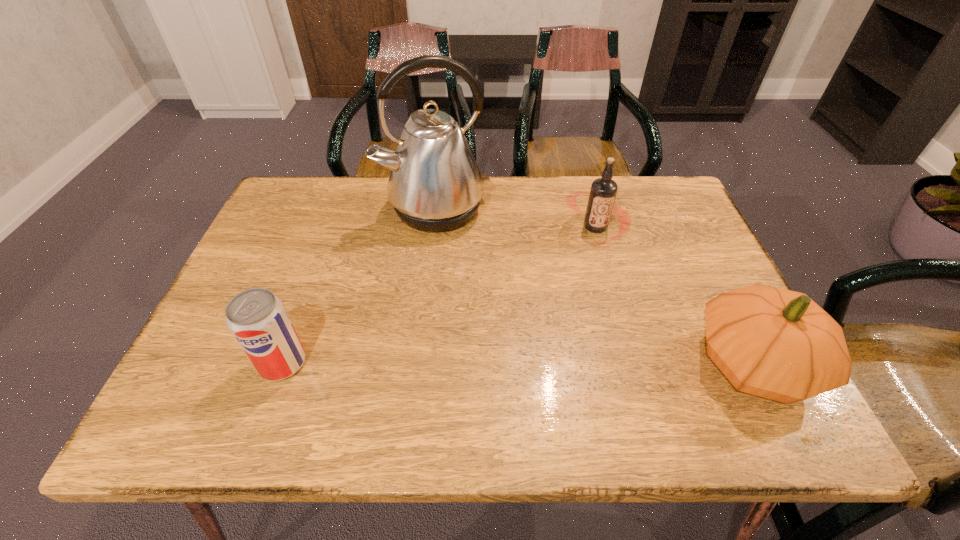
This screenshot has width=960, height=540. I want to click on free space between the leftmost object and the third object from right to left, so click(x=359, y=286).

At what (x,y) coordinates should I click in order to perform the action: click on vacant point located between the kettle and the gourd. Please return your answer as a coordinate pair (x, y). The height and width of the screenshot is (540, 960). Looking at the image, I should click on (595, 286).

This screenshot has height=540, width=960. I want to click on free space between the third object from right to left and the root beer, so click(x=516, y=218).

This screenshot has width=960, height=540. I want to click on vacant area between the leftmost object and the second object from left to right, so click(x=359, y=286).

Identify the location of vacant area that lies between the leftmost object and the kettle. (359, 286).

The height and width of the screenshot is (540, 960). Identify the location of free space between the second object from right to left and the tallest object. (516, 218).

Locate which object is the second closest to the gourd. Please provide its 2D coordinates. Your answer should be formatted as a tuple, i.e. [(x, y)], where the tuple contains the x and y coordinates of a point satisfying the conditions above.

[(435, 185)]

You are a GUI agent. You are given a task and a screenshot of the screen. Output one action in this format:
    pyautogui.click(x=<x>, y=<y>)
    Task: Click on the object that can be found as the third closest to the tallest object
    The width and height of the screenshot is (960, 540).
    Given the screenshot: What is the action you would take?
    pyautogui.click(x=779, y=344)

Where is `free space that satisfies the following two spatial constraints: 1. on the back side of the kettle; 2. on the right side of the soda`? This screenshot has height=540, width=960. free space that satisfies the following two spatial constraints: 1. on the back side of the kettle; 2. on the right side of the soda is located at coordinates (339, 208).

Locate an element on the screen. free spot that satisfies the following two spatial constraints: 1. on the front side of the root beer; 2. on the side of the rightmost object with the carved face is located at coordinates (634, 363).